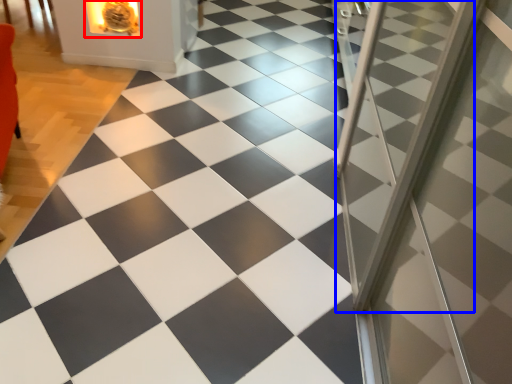
Question: Which of the following is the farthest to the observer, fireplace (highlighted by a red box) or screen door (highlighted by a blue box)?

Choices:
 (A) fireplace
 (B) screen door

Answer: (A)